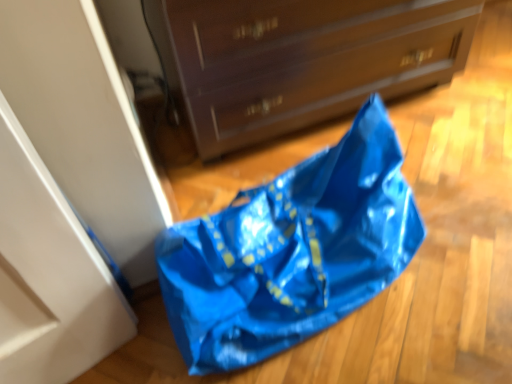
What do you see at coordinates (300, 59) in the screenshot?
I see `matte brown chest of drawers at center` at bounding box center [300, 59].

The width and height of the screenshot is (512, 384). I want to click on matte brown chest of drawers at center, so click(x=300, y=59).

Where is `blue plastic bag at lower center`? blue plastic bag at lower center is located at coordinates (291, 251).

The image size is (512, 384). What do you see at coordinates (291, 251) in the screenshot?
I see `blue plastic bag at lower center` at bounding box center [291, 251].

You are a GUI agent. You are given a task and a screenshot of the screen. Output one action in this format:
    pyautogui.click(x=<x>, y=<y>)
    Task: Click on the matte brown chest of drawers at center
    The image size is (512, 384).
    Given the screenshot: What is the action you would take?
    pyautogui.click(x=300, y=59)

In the image, is matte brown chest of drawers at center on the left side or the right side of blue plastic bag at lower center?

From the image, it's evident that matte brown chest of drawers at center is to the right of blue plastic bag at lower center.

Considering the relative positions of matte brown chest of drawers at center and blue plastic bag at lower center in the image provided, is matte brown chest of drawers at center in front of blue plastic bag at lower center?

No, matte brown chest of drawers at center is further to the viewer.

Is point (414, 0) positioned before point (300, 194)?

No, it is behind (300, 194).

Based on the photo, from the image's perspective, who appears lower, matte brown chest of drawers at center or blue plastic bag at lower center?

From the image's view, blue plastic bag at lower center is below.

From a real-world perspective, who is located lower, matte brown chest of drawers at center or blue plastic bag at lower center?

blue plastic bag at lower center is physically lower.

Which object is wider, matte brown chest of drawers at center or blue plastic bag at lower center?

Wider between the two is matte brown chest of drawers at center.

Consider the image. Considering the sizes of objects matte brown chest of drawers at center and blue plastic bag at lower center in the image provided, who is taller, matte brown chest of drawers at center or blue plastic bag at lower center?

Standing taller between the two is matte brown chest of drawers at center.

Considering the relative sizes of matte brown chest of drawers at center and blue plastic bag at lower center in the image provided, is matte brown chest of drawers at center bigger than blue plastic bag at lower center?

Correct, matte brown chest of drawers at center is larger in size than blue plastic bag at lower center.

Is blue plastic bag at lower center completely or partially inside matte brown chest of drawers at center?

No, blue plastic bag at lower center is not a part of matte brown chest of drawers at center.

Would you say matte brown chest of drawers at center is a long distance from blue plastic bag at lower center?

matte brown chest of drawers at center is near blue plastic bag at lower center, not far away.

In the scene shown: Is matte brown chest of drawers at center oriented towards blue plastic bag at lower center?

Yes, matte brown chest of drawers at center is turned towards blue plastic bag at lower center.

How different are the orientations of matte brown chest of drawers at center and blue plastic bag at lower center in degrees?

The angle between the facing direction of matte brown chest of drawers at center and the facing direction of blue plastic bag at lower center is 10.5 degrees.

The image size is (512, 384). What are the coordinates of `grocery bag to the left of matte brown chest of drawers at center` in the screenshot? It's located at (291, 251).

Considering the positions of objects blue plastic bag at lower center and matte brown chest of drawers at center in the image provided, who is more to the right, blue plastic bag at lower center or matte brown chest of drawers at center?

matte brown chest of drawers at center is more to the right.

Between blue plastic bag at lower center and matte brown chest of drawers at center, which one is positioned behind?

matte brown chest of drawers at center is further away from the camera.

Does point (300, 219) come in front of point (226, 145)?

Yes, point (300, 219) is closer to viewer.

From the image's perspective, is blue plastic bag at lower center on matte brown chest of drawers at center?

No.

From a real-world perspective, is blue plastic bag at lower center beneath matte brown chest of drawers at center?

Yes.

Which object is thinner, blue plastic bag at lower center or matte brown chest of drawers at center?

With smaller width is blue plastic bag at lower center.

Considering the sizes of objects blue plastic bag at lower center and matte brown chest of drawers at center in the image provided, who is taller, blue plastic bag at lower center or matte brown chest of drawers at center?

matte brown chest of drawers at center is taller.

Considering the sizes of objects blue plastic bag at lower center and matte brown chest of drawers at center in the image provided, who is bigger, blue plastic bag at lower center or matte brown chest of drawers at center?

matte brown chest of drawers at center.

Is blue plastic bag at lower center spatially inside matte brown chest of drawers at center, or outside of it?

blue plastic bag at lower center is spatially situated outside matte brown chest of drawers at center.

Is blue plastic bag at lower center beside matte brown chest of drawers at center?

No, blue plastic bag at lower center is not touching matte brown chest of drawers at center.

Is blue plastic bag at lower center oriented towards matte brown chest of drawers at center?

No, blue plastic bag at lower center is not oriented towards matte brown chest of drawers at center.

Measure the distance from blue plastic bag at lower center to matte brown chest of drawers at center.

The distance of blue plastic bag at lower center from matte brown chest of drawers at center is 35.71 centimeters.

Locate an element on the screen. This screenshot has height=384, width=512. grocery bag that appears below the matte brown chest of drawers at center (from the image's perspective) is located at coordinates (291, 251).

You are a GUI agent. You are given a task and a screenshot of the screen. Output one action in this format:
    pyautogui.click(x=<x>, y=<y>)
    Task: Click on the grocery bag on the left side of matte brown chest of drawers at center
    The image size is (512, 384).
    Given the screenshot: What is the action you would take?
    pyautogui.click(x=291, y=251)

Find the location of `the chest of drawers located above the blue plastic bag at lower center (from a real-world perspective)`. the chest of drawers located above the blue plastic bag at lower center (from a real-world perspective) is located at coordinates (300, 59).